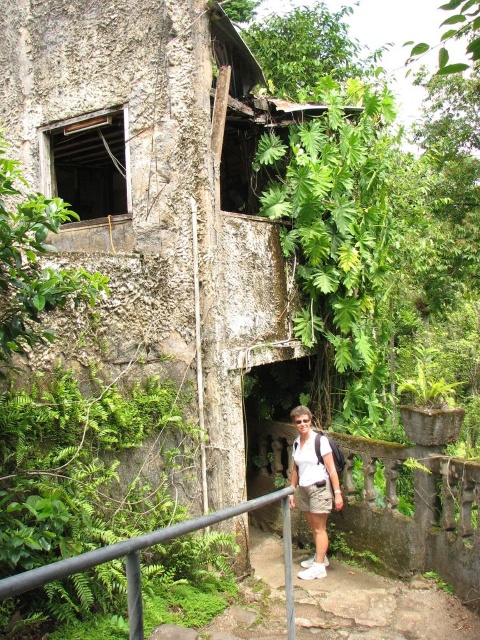
Question: Which point is farther to the camera?

Choices:
 (A) white cotton shirt at center
 (B) black metal/rail at lower center

Answer: (A)

Question: Which point is farther to the camera?

Choices:
 (A) (267, 493)
 (B) (409, 600)
 (C) (314, 456)

Answer: (A)

Question: Observing the image, what is the correct spatial positioning of brown stone steps at center in reference to black metal/rail at lower center?

Choices:
 (A) below
 (B) above

Answer: (A)

Question: Does black metal/rail at lower center come behind white cotton shirt at center?

Choices:
 (A) no
 (B) yes

Answer: (A)

Question: Can you confirm if brown stone steps at center is wider than black metal/rail at lower center?

Choices:
 (A) no
 (B) yes

Answer: (B)

Question: Which point is farther to the camera?

Choices:
 (A) brown stone steps at center
 (B) white cotton shirt at center

Answer: (B)